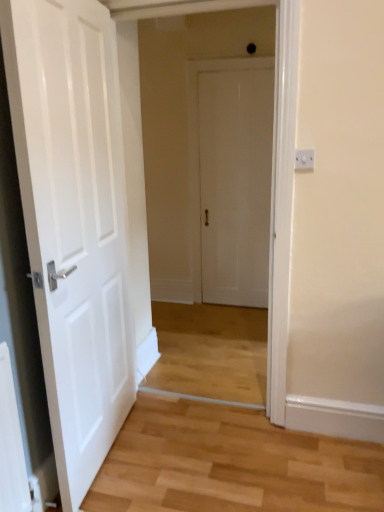
Question: Is white matte door at center, which is the 1th door in left-to-right order, in front of or behind white matte door at center, which is the 2th door in left-to-right order, in the image?

Choices:
 (A) front
 (B) behind

Answer: (A)

Question: Choose the correct answer: Is white matte door at center, placed as the 2th door when sorted from right to left, inside white matte door at center, which is the 2th door in left-to-right order, or outside it?

Choices:
 (A) outside
 (B) inside

Answer: (A)

Question: Which object is the closest to the white matte door at center, which is the 1th door in left-to-right order?

Choices:
 (A) white matte door at center, the 1th door positioned from the back
 (B) white plastic switch at upper right

Answer: (B)

Question: Which object is the closest to the white matte door at center, the first door when ordered from front to back?

Choices:
 (A) white matte door at center, which ranks as the 1th door in right-to-left order
 (B) white plastic switch at upper right

Answer: (B)